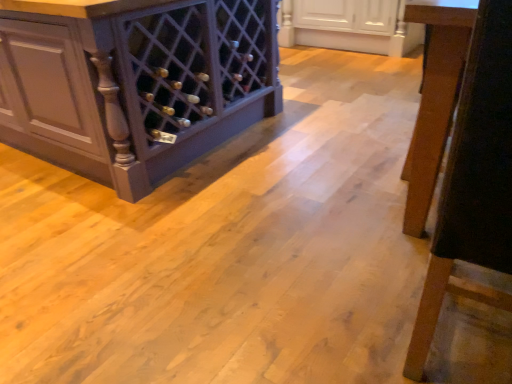
Question: Which direction should I rotate to face white glossy cabinet at upper center, which is counted as the 1th cabinetry, starting from the right, — up or down?

Choices:
 (A) up
 (B) down

Answer: (A)

Question: Considering the relative positions of matte dark wood wine rack at left, which ranks as the 2th cabinetry in right-to-left order, and white glossy cabinet at upper center, which appears as the 2th cabinetry when viewed from the left, in the image provided, is matte dark wood wine rack at left, which ranks as the 2th cabinetry in right-to-left order, to the left of white glossy cabinet at upper center, which appears as the 2th cabinetry when viewed from the left, from the viewer's perspective?

Choices:
 (A) yes
 (B) no

Answer: (A)

Question: From a real-world perspective, is matte dark wood wine rack at left, which ranks as the 2th cabinetry in right-to-left order, located beneath white glossy cabinet at upper center, which is counted as the 1th cabinetry, starting from the right?

Choices:
 (A) no
 (B) yes

Answer: (A)

Question: Is the depth of matte dark wood wine rack at left, the 1th cabinetry from the left, less than that of white glossy cabinet at upper center, which is counted as the 1th cabinetry, starting from the right?

Choices:
 (A) no
 (B) yes

Answer: (B)

Question: Does matte dark wood wine rack at left, which ranks as the 2th cabinetry in right-to-left order, have a smaller size compared to white glossy cabinet at upper center, which appears as the 2th cabinetry when viewed from the left?

Choices:
 (A) yes
 (B) no

Answer: (B)

Question: Considering the relative sizes of matte dark wood wine rack at left, the 1th cabinetry from the left, and white glossy cabinet at upper center, which is counted as the 1th cabinetry, starting from the right, in the image provided, is matte dark wood wine rack at left, the 1th cabinetry from the left, bigger than white glossy cabinet at upper center, which is counted as the 1th cabinetry, starting from the right,?

Choices:
 (A) yes
 (B) no

Answer: (A)

Question: Is matte dark wood wine rack at left, the 1th cabinetry from the left, completely or partially outside of white glossy cabinet at upper center, which is counted as the 1th cabinetry, starting from the right?

Choices:
 (A) no
 (B) yes

Answer: (B)

Question: Considering the relative sizes of wooden chair leg at right and white glossy cabinet at upper center, which appears as the 2th cabinetry when viewed from the left, in the image provided, is wooden chair leg at right smaller than white glossy cabinet at upper center, which appears as the 2th cabinetry when viewed from the left,?

Choices:
 (A) yes
 (B) no

Answer: (A)

Question: Is white glossy cabinet at upper center, which is counted as the 1th cabinetry, starting from the right, completely or partially inside wooden chair leg at right?

Choices:
 (A) no
 (B) yes

Answer: (A)

Question: Is wooden chair leg at right wider than white glossy cabinet at upper center, which is counted as the 1th cabinetry, starting from the right?

Choices:
 (A) yes
 (B) no

Answer: (B)

Question: Can you confirm if wooden chair leg at right is thinner than white glossy cabinet at upper center, which appears as the 2th cabinetry when viewed from the left?

Choices:
 (A) no
 (B) yes

Answer: (B)

Question: Is wooden chair leg at right outside of white glossy cabinet at upper center, which appears as the 2th cabinetry when viewed from the left?

Choices:
 (A) yes
 (B) no

Answer: (A)

Question: Is wooden chair leg at right behind white glossy cabinet at upper center, which appears as the 2th cabinetry when viewed from the left?

Choices:
 (A) yes
 (B) no

Answer: (B)

Question: Does matte dark wood wine rack at left, the 1th cabinetry from the left, have a lesser width compared to wooden chair leg at right?

Choices:
 (A) no
 (B) yes

Answer: (A)